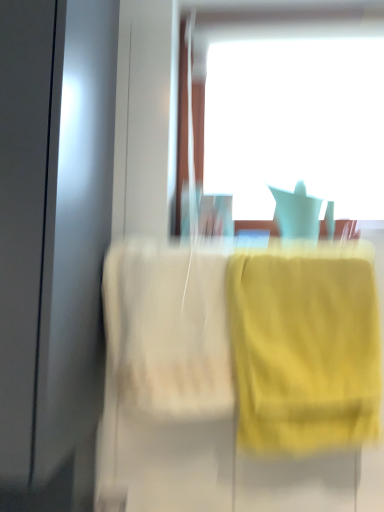
Question: Considering the positions of transparent glass window at upper center and yellow fabric towel at right in the image, is transparent glass window at upper center wider or thinner than yellow fabric towel at right?

Choices:
 (A) thin
 (B) wide

Answer: (A)

Question: Looking at the image, does transparent glass window at upper center seem bigger or smaller compared to yellow fabric towel at right?

Choices:
 (A) big
 (B) small

Answer: (A)

Question: Considering the positions of transparent glass window at upper center and yellow fabric towel at right in the image, is transparent glass window at upper center taller or shorter than yellow fabric towel at right?

Choices:
 (A) tall
 (B) short

Answer: (A)

Question: From their relative heights in the image, would you say yellow fabric towel at right is taller or shorter than transparent glass window at upper center?

Choices:
 (A) tall
 (B) short

Answer: (B)

Question: Relative to transparent glass window at upper center, is yellow fabric towel at right in front or behind?

Choices:
 (A) behind
 (B) front

Answer: (B)

Question: Considering the positions of yellow fabric towel at right and transparent glass window at upper center in the image, is yellow fabric towel at right bigger or smaller than transparent glass window at upper center?

Choices:
 (A) big
 (B) small

Answer: (B)

Question: From the image's perspective, is yellow fabric towel at right above or below transparent glass window at upper center?

Choices:
 (A) above
 (B) below

Answer: (B)